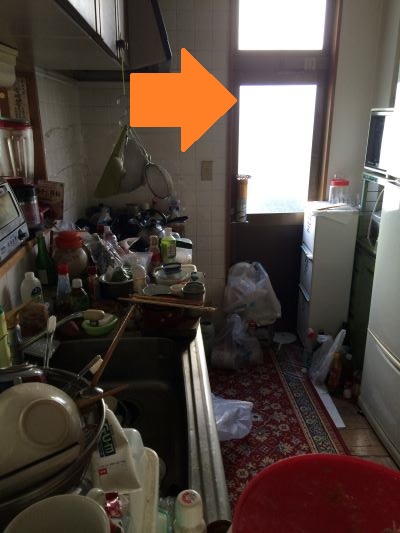
You are a GUI agent. You are given a task and a screenshot of the screen. Output one action in this format:
    pyautogui.click(x=<x>, y=<y>)
    Task: Click on the fridge
    Image resolution: width=400 pixels, height=533 pixels.
    Given the screenshot: What is the action you would take?
    pos(386,278)